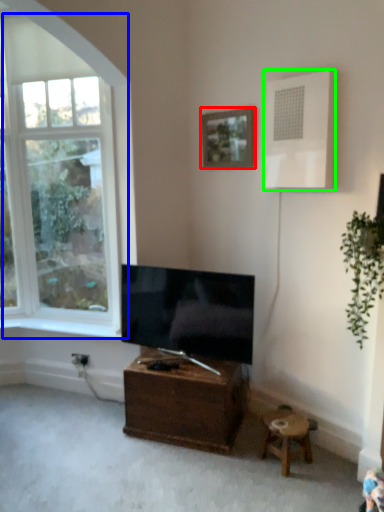
Question: Which object is positioned closest to picture frame (highlighted by a red box)? Select from window (highlighted by a blue box) and air conditioner (highlighted by a green box).

Choices:
 (A) window
 (B) air conditioner

Answer: (B)